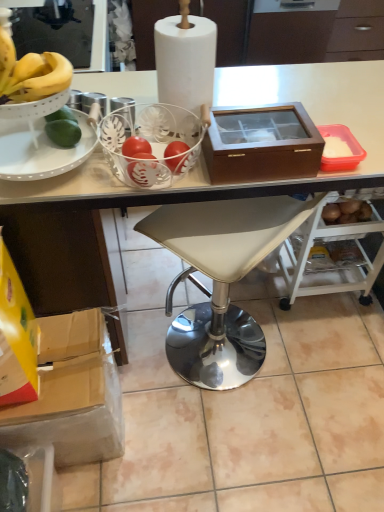
Question: Is white leather stool at center a part of white paper at center?

Choices:
 (A) yes
 (B) no

Answer: (B)

Question: Considering the relative sizes of white paper at center and white leather stool at center in the image provided, is white paper at center wider than white leather stool at center?

Choices:
 (A) no
 (B) yes

Answer: (A)

Question: Can we say white paper at center lies outside white leather stool at center?

Choices:
 (A) yes
 (B) no

Answer: (A)

Question: Can you confirm if white paper at center is positioned to the left of white leather stool at center?

Choices:
 (A) yes
 (B) no

Answer: (A)

Question: Is white paper at center taller than white leather stool at center?

Choices:
 (A) yes
 (B) no

Answer: (B)

Question: Relative to brown wood box at upper right, is cardboard box at lower left in front or behind?

Choices:
 (A) front
 (B) behind

Answer: (B)

Question: Looking at the image, does cardboard box at lower left seem bigger or smaller compared to brown wood box at upper right?

Choices:
 (A) big
 (B) small

Answer: (A)

Question: Does point (79, 394) appear closer or farther from the camera than point (291, 146)?

Choices:
 (A) farther
 (B) closer

Answer: (A)

Question: From a real-world perspective, is cardboard box at lower left above or below brown wood box at upper right?

Choices:
 (A) below
 (B) above

Answer: (A)

Question: From a real-world perspective, is white leather stool at center above or below white paper at center?

Choices:
 (A) above
 (B) below

Answer: (B)

Question: Considering the positions of point (94, 158) and point (198, 91), is point (94, 158) closer or farther from the camera than point (198, 91)?

Choices:
 (A) farther
 (B) closer

Answer: (A)

Question: In terms of width, does white leather stool at center look wider or thinner when compared to white paper at center?

Choices:
 (A) thin
 (B) wide

Answer: (B)

Question: Is white leather stool at center in front of or behind white paper at center in the image?

Choices:
 (A) behind
 (B) front

Answer: (A)

Question: From a real-world perspective, relative to cardboard box at lower left, is brown wood box at upper right vertically above or below?

Choices:
 (A) below
 (B) above

Answer: (B)

Question: From the image's perspective, is brown wood box at upper right located above or below cardboard box at lower left?

Choices:
 (A) below
 (B) above

Answer: (B)